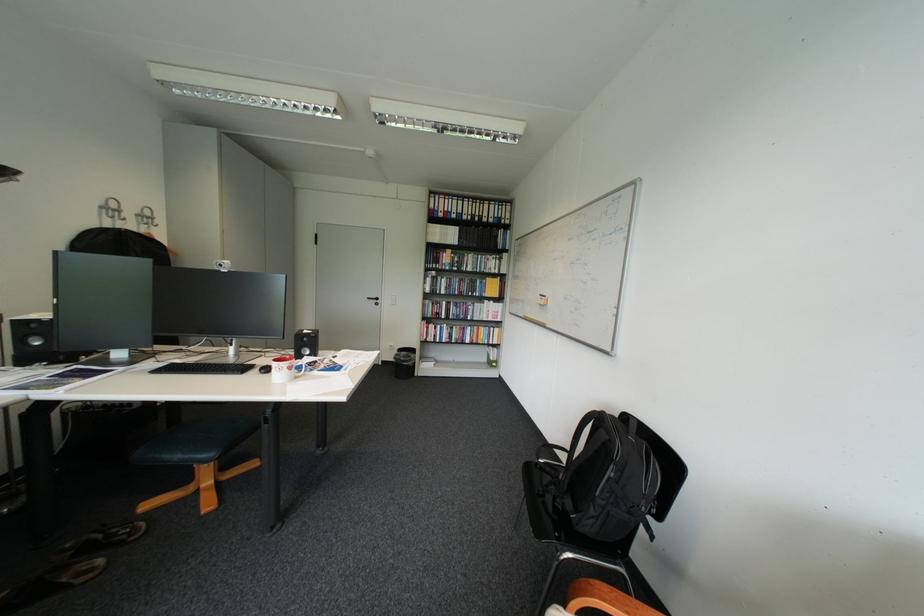
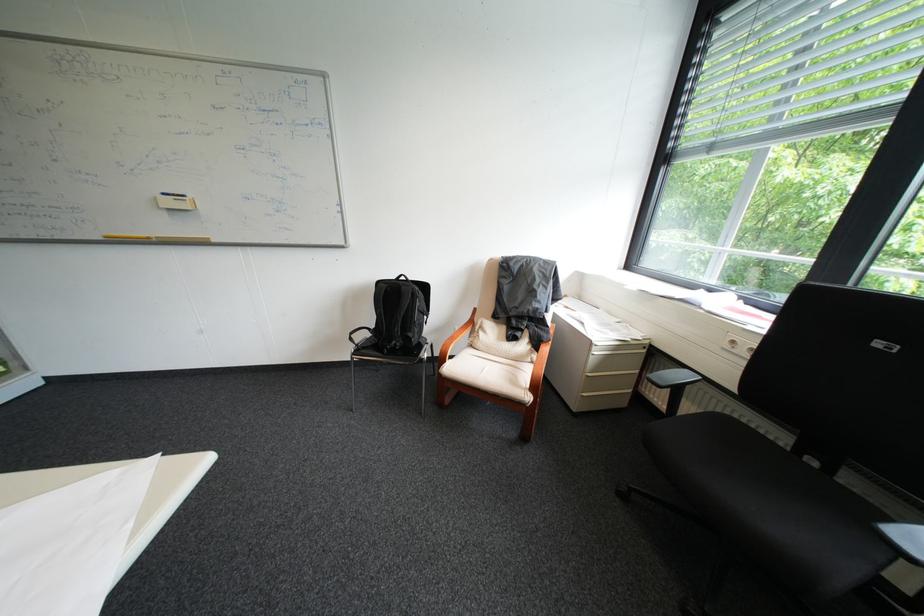
Where in the second image is the point corresponding to [553,296] from the first image?

(176, 195)